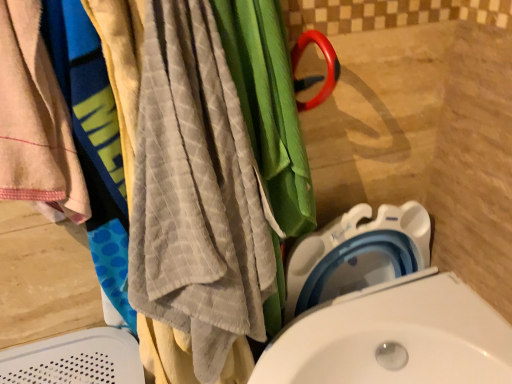
Question: Looking at the image, does gray textured towel at left seem bigger or smaller compared to beige cotton towel at left?

Choices:
 (A) small
 (B) big

Answer: (B)

Question: Is point (154, 89) closer or farther from the camera than point (81, 200)?

Choices:
 (A) farther
 (B) closer

Answer: (B)

Question: Based on their relative distances, which object is farther from the white plastic toilet at lower right?

Choices:
 (A) gray textured towel at left
 (B) beige cotton towel at left

Answer: (B)

Question: Which is farther from the white plastic toilet at lower right?

Choices:
 (A) beige cotton towel at left
 (B) gray textured towel at left

Answer: (A)